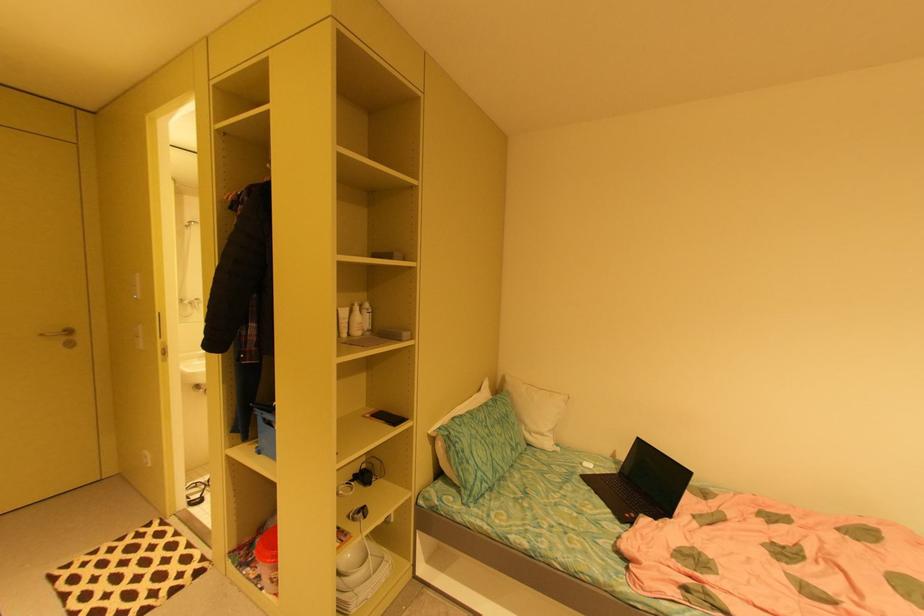
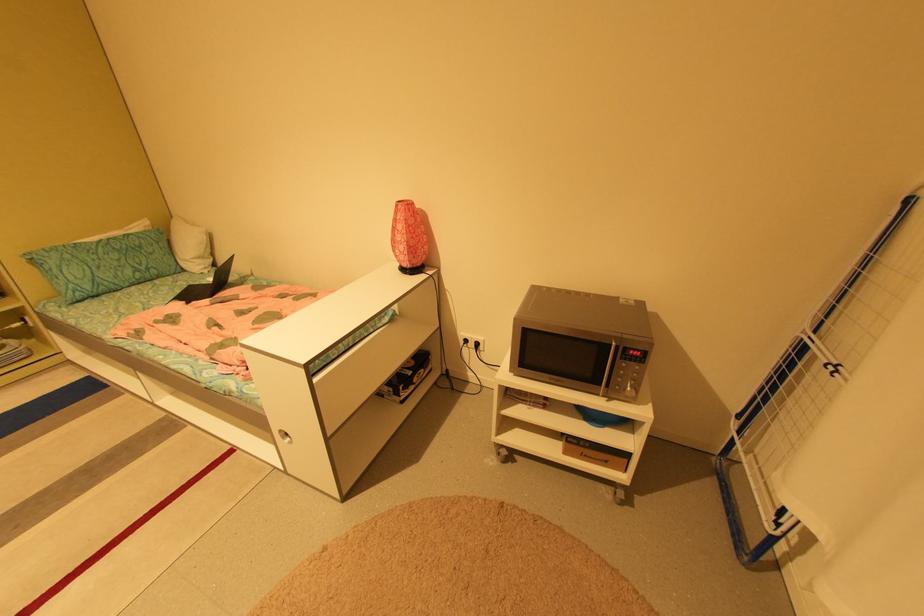
Where in the second image is the point corresponding to the point at 511,411 from the first image?

(142, 244)